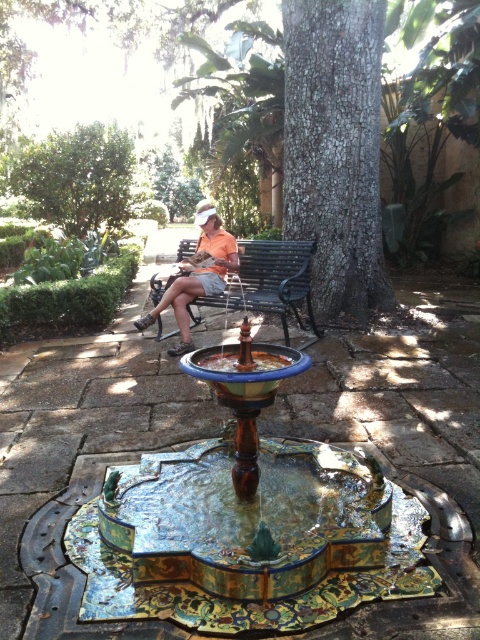
You are a park visitor who wants to sit on the black metal bench at center. Can you tell me which direction you should look to see the brown rough bark tree at center?

The brown rough bark tree at center is above the black metal bench at center, so you should look upward to see the brown rough bark tree at center.

Looking at this image, you are planning to place a small potted plant between the brown rough bark tree at center and the black metal bench at center. Based on their widths, which object should the plant be closer to?

The brown rough bark tree at center might be wider than the black metal bench at center, so the plant should be placed closer to the black metal bench at center to maintain balance between their widths.